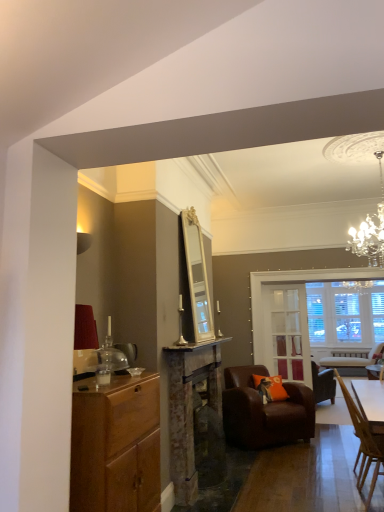
Question: From their relative heights in the image, would you say orange fabric pillow at center is taller or shorter than rusty metal fireplace at center?

Choices:
 (A) short
 (B) tall

Answer: (A)

Question: In the image, is orange fabric pillow at center positioned in front of or behind rusty metal fireplace at center?

Choices:
 (A) front
 (B) behind

Answer: (B)

Question: Estimate the real-world distances between objects in this image. Which object is farther from the wooden cabinet at left?

Choices:
 (A) rusty metal fireplace at center
 (B) clear glass door at center
 (C) wooden chair at lower right, which appears as the 1th chair when viewed from the front
 (D) brown leather armchair at center, which is the second chair from front to back
 (E) orange fabric pillow at center

Answer: (B)

Question: Estimate the real-world distances between objects in this image. Which object is farther from the orange fabric pillow at center?

Choices:
 (A) wooden cabinet at left
 (B) wooden chair at lower right, which appears as the 1th chair when viewed from the front
 (C) clear glass door at center
 (D) rusty metal fireplace at center
 (E) brown leather armchair at center, which is the 1th chair in back-to-front order

Answer: (A)